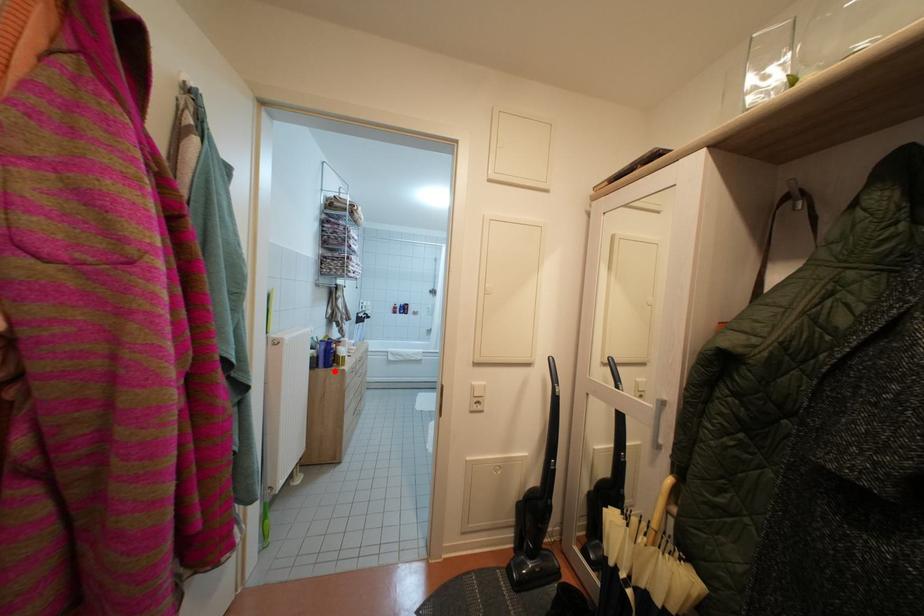
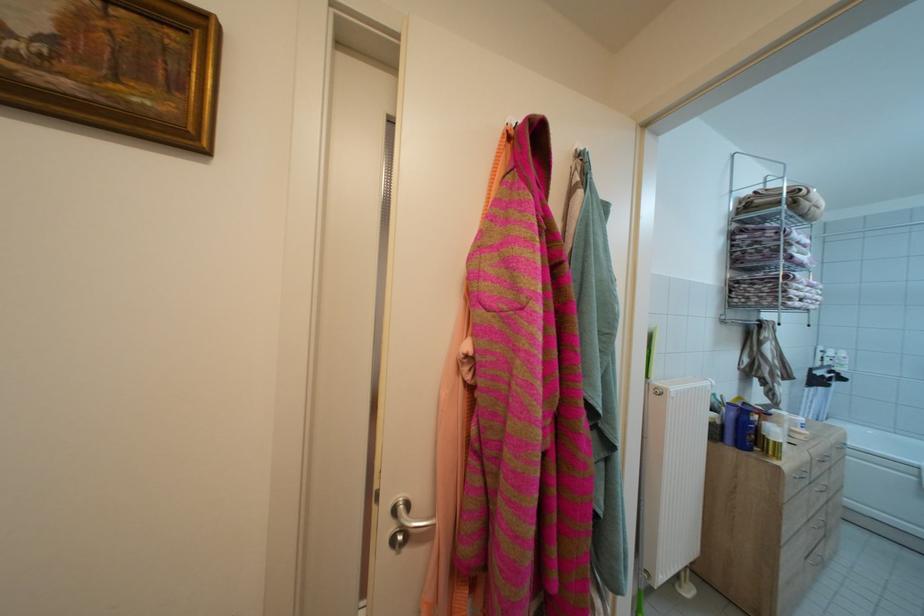
Question: I am providing you with two images of the same scene from different viewpoints. A red point is marked on the first image. Is the red point's position out of view in image 2?

Choices:
 (A) Yes
 (B) No

Answer: (B)